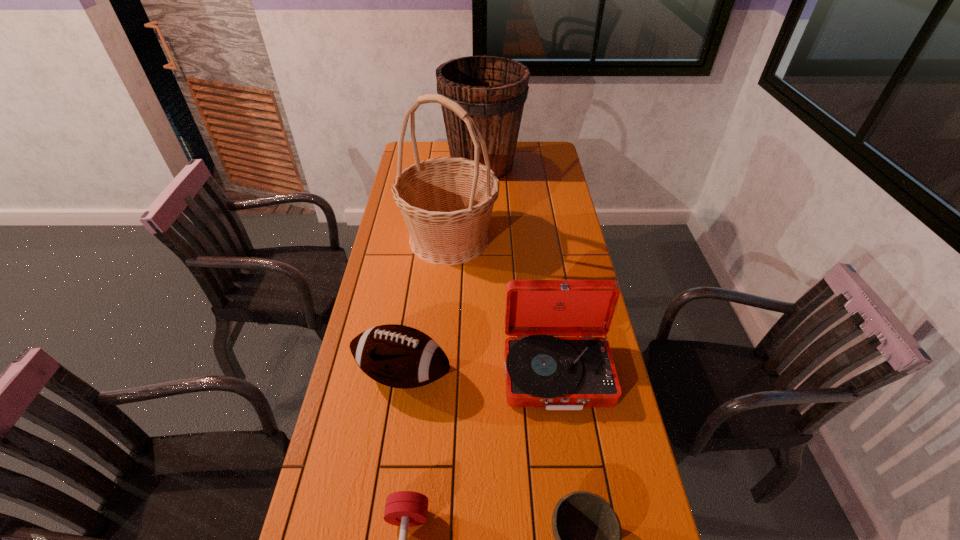
At what (x,y) coordinates should I click in order to perform the action: click on vacant region between the second farthest object and the phonograph_record. Please return your answer as a coordinate pair (x, y). Looking at the image, I should click on (503, 307).

This screenshot has width=960, height=540. What are the coordinates of `free space between the phonograph_record and the second tallest object` in the screenshot? It's located at (519, 269).

Select which object appears as the fifth closest to the bowl. Please provide its 2D coordinates. Your answer should be formatted as a tuple, i.e. [(x, y)], where the tuple contains the x and y coordinates of a point satisfying the conditions above.

[(493, 90)]

The image size is (960, 540). In order to click on the fifth closest object relative to the phonograph_record in this screenshot , I will do `click(493, 90)`.

This screenshot has width=960, height=540. I want to click on free space in the image that satisfies the following two spatial constraints: 1. on the back side of the third shortest object; 2. on the left side of the basket, so click(422, 239).